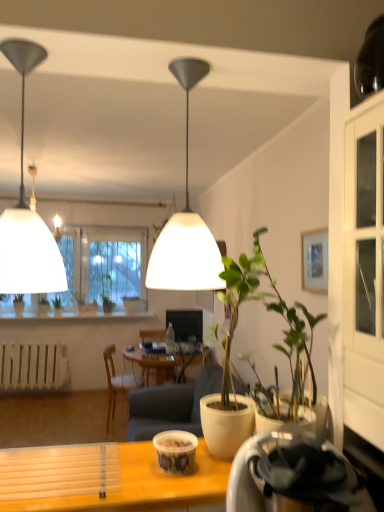
Question: Is green matte plant at center, the 2th houseplant from the left, smaller than white matte radiator at lower left?

Choices:
 (A) no
 (B) yes

Answer: (B)

Question: Is green matte plant at center, which ranks as the third houseplant in right-to-left order, to the left of white matte radiator at lower left from the viewer's perspective?

Choices:
 (A) no
 (B) yes

Answer: (A)

Question: From a real-world perspective, is green matte plant at center, the 2th houseplant viewed from the back, under white matte radiator at lower left?

Choices:
 (A) no
 (B) yes

Answer: (A)

Question: Is the depth of green matte plant at center, the 2th houseplant viewed from the back, greater than that of white matte radiator at lower left?

Choices:
 (A) yes
 (B) no

Answer: (A)

Question: Does green matte plant at center, the 3th houseplant from the front, lie in front of white matte radiator at lower left?

Choices:
 (A) yes
 (B) no

Answer: (B)

Question: Visually, is wooden chair at center positioned to the left or to the right of wooden desk at lower center?

Choices:
 (A) right
 (B) left

Answer: (B)

Question: Does point (107, 347) appear closer or farther from the camera than point (69, 468)?

Choices:
 (A) farther
 (B) closer

Answer: (A)

Question: In the image, is wooden chair at center positioned in front of or behind wooden desk at lower center?

Choices:
 (A) behind
 (B) front

Answer: (A)

Question: From the image's perspective, relative to wooden desk at lower center, is wooden chair at center above or below?

Choices:
 (A) below
 (B) above

Answer: (A)

Question: In the image, is matte white lampshade at upper left, which ranks as the second lamp in right-to-left order, positioned in front of or behind green matte plant at center, which is the fourth houseplant in left-to-right order?

Choices:
 (A) behind
 (B) front

Answer: (A)

Question: From the image's perspective, is matte white lampshade at upper left, placed as the 1th lamp when sorted from left to right, above or below green matte plant at center, the fourth houseplant in the back-to-front sequence?

Choices:
 (A) below
 (B) above

Answer: (B)

Question: Is matte white lampshade at upper left, placed as the 1th lamp when sorted from left to right, to the left or to the right of green matte plant at center, the fourth houseplant in the back-to-front sequence, in the image?

Choices:
 (A) right
 (B) left

Answer: (B)

Question: Is matte white lampshade at upper left, which ranks as the second lamp in right-to-left order, spatially inside green matte plant at center, which is counted as the 1th houseplant, starting from the front, or outside of it?

Choices:
 (A) inside
 (B) outside

Answer: (B)

Question: Considering the positions of point (59, 302) and point (84, 305), is point (59, 302) closer or farther from the camera than point (84, 305)?

Choices:
 (A) farther
 (B) closer

Answer: (B)

Question: Looking at the image, does green matte plant at lower left, which is counted as the 1th houseplant, starting from the left, seem bigger or smaller compared to green matte plant at center, the 3th houseplant from the front?

Choices:
 (A) small
 (B) big

Answer: (A)